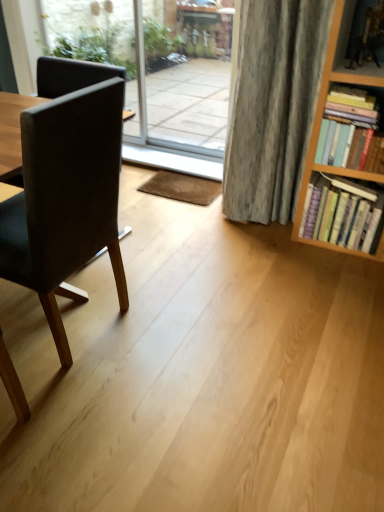
Question: Is transparent glass screen door at center outside matte black chair at left?

Choices:
 (A) no
 (B) yes

Answer: (B)

Question: Can you confirm if transparent glass screen door at center is bigger than matte black chair at left?

Choices:
 (A) no
 (B) yes

Answer: (A)

Question: Considering the relative sizes of transparent glass screen door at center and matte black chair at left in the image provided, is transparent glass screen door at center taller than matte black chair at left?

Choices:
 (A) yes
 (B) no

Answer: (A)

Question: Is matte black chair at left surrounded by transparent glass screen door at center?

Choices:
 (A) no
 (B) yes

Answer: (A)

Question: Is transparent glass screen door at center shorter than matte black chair at left?

Choices:
 (A) no
 (B) yes

Answer: (A)

Question: Do you think hardcover books at right, arranged as the second book when viewed from the top, is within hardcover books at right, the 1th book positioned from the top, or outside of it?

Choices:
 (A) outside
 (B) inside

Answer: (A)

Question: Considering their positions, is hardcover books at right, arranged as the first book when ordered from the bottom, located in front of or behind hardcover books at right, the second book in the bottom-to-top sequence?

Choices:
 (A) front
 (B) behind

Answer: (B)

Question: In terms of size, does hardcover books at right, arranged as the first book when ordered from the bottom, appear bigger or smaller than hardcover books at right, the 1th book positioned from the top?

Choices:
 (A) small
 (B) big

Answer: (B)

Question: In terms of width, does hardcover books at right, arranged as the second book when viewed from the top, look wider or thinner when compared to hardcover books at right, the second book in the bottom-to-top sequence?

Choices:
 (A) wide
 (B) thin

Answer: (A)

Question: From the image's perspective, relative to wooden bookshelf at right, is matte black chair at left above or below?

Choices:
 (A) above
 (B) below

Answer: (B)

Question: In the image, is matte black chair at left on the left side or the right side of wooden bookshelf at right?

Choices:
 (A) left
 (B) right

Answer: (A)

Question: Does point (92, 128) appear closer or farther from the camera than point (359, 72)?

Choices:
 (A) closer
 (B) farther

Answer: (A)

Question: From a real-world perspective, is matte black chair at left positioned above or below wooden bookshelf at right?

Choices:
 (A) below
 (B) above

Answer: (A)

Question: Visually, is black leather chair at left positioned to the left or to the right of transparent glass screen door at center?

Choices:
 (A) right
 (B) left

Answer: (B)

Question: Considering the positions of point (195, 116) and point (190, 49), is point (195, 116) closer or farther from the camera than point (190, 49)?

Choices:
 (A) farther
 (B) closer

Answer: (B)